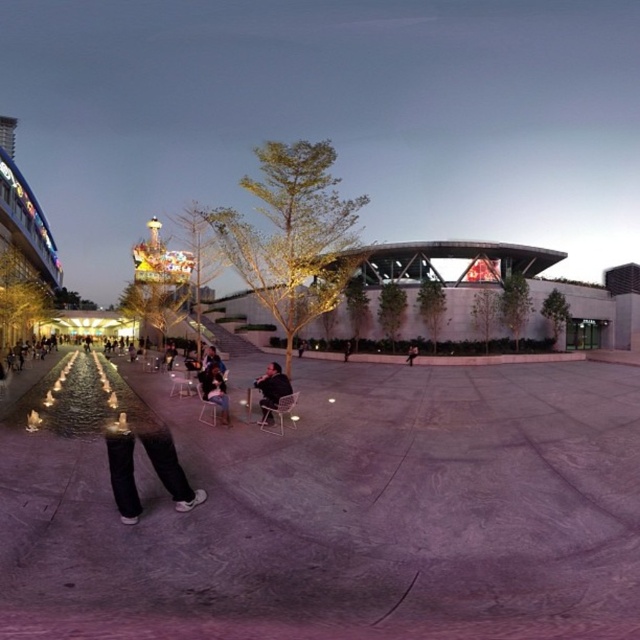
What is the location of the point with coordinates (x=333, y=509) in the urban plaza scene?

The point with coordinates (x=333, y=509) is located on the concrete skate park at center.

You are a photographer positioned at the back of the plaza and want to capture both the dark blue jeans at center and the dark gray pants at center in the same frame. Which one should you focus on first to ensure both are in focus?

You should focus on the dark blue jeans at center first because it is in front of the dark gray pants at center, so focusing on the closer subject will help both be in focus.